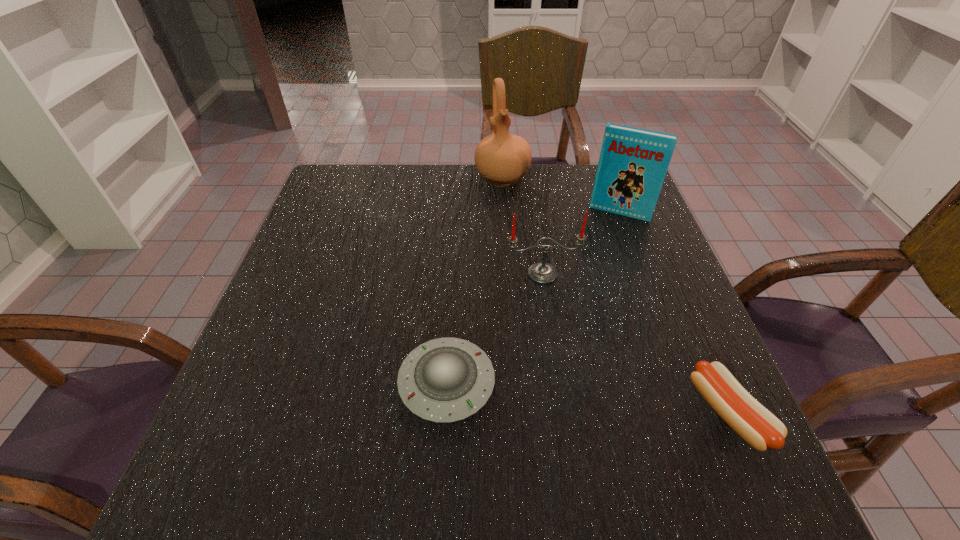
Find the location of a particular element. This screenshot has width=960, height=540. vacant region located 0.250m on the front cover of the book is located at coordinates 588,284.

Locate an element on the screen. This screenshot has height=540, width=960. vacant position located 0.350m on the front-facing side of the third farthest object is located at coordinates (584, 431).

Where is `free location located 0.150m on the front-facing side of the third farthest object`? free location located 0.150m on the front-facing side of the third farthest object is located at coordinates (561, 338).

You are a GUI agent. You are given a task and a screenshot of the screen. Output one action in this format:
    pyautogui.click(x=<x>, y=<y>)
    Task: Click on the free space located on the front-facing side of the third farthest object
    The width and height of the screenshot is (960, 540).
    Given the screenshot: What is the action you would take?
    pyautogui.click(x=566, y=362)

This screenshot has height=540, width=960. Find the location of `vacant region located 0.190m on the spout of the farthest object`. vacant region located 0.190m on the spout of the farthest object is located at coordinates (517, 237).

At what (x,y) coordinates should I click in order to perform the action: click on free region located on the spout of the farthest object. Please return your answer as a coordinate pair (x, y). Looking at the image, I should click on (520, 247).

I want to click on vacant space located 0.340m on the spout of the farthest object, so click(528, 279).

The width and height of the screenshot is (960, 540). Find the location of `book that is at the far edge`. book that is at the far edge is located at coordinates (633, 162).

The image size is (960, 540). I want to click on pottery that is at the far edge, so click(502, 158).

Find the location of a particular element. This screenshot has height=540, width=960. saucer present at the near edge is located at coordinates (444, 380).